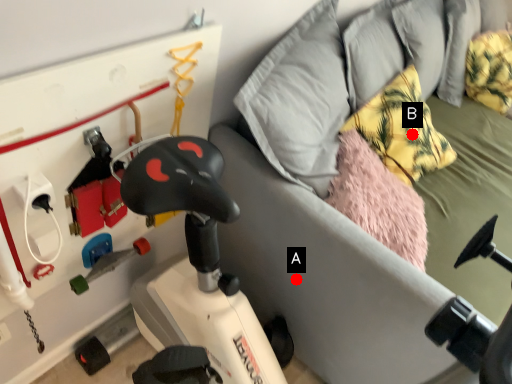
Question: Two points are circled on the image, labeled by A and B beside each circle. Which point appears closest to the camera in this image?

Choices:
 (A) A is closer
 (B) B is closer

Answer: (A)